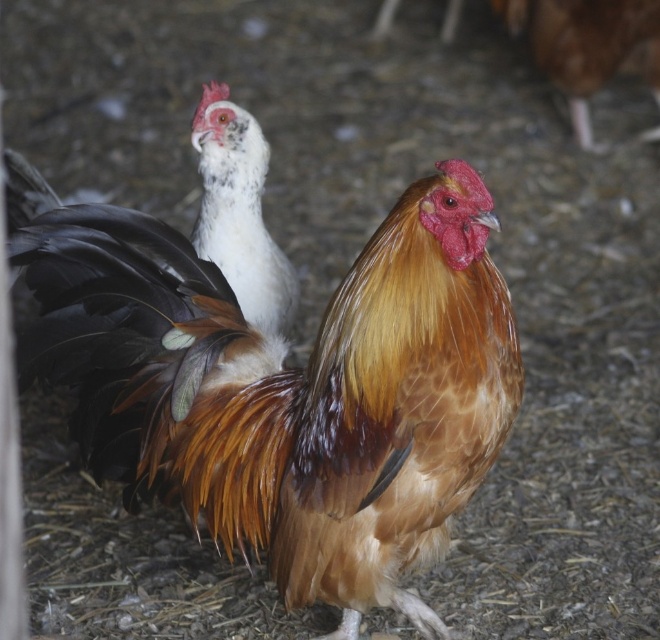
Is brown feathered rooster at center thinner than white feathered chicken at upper left?

No.

Is brown feathered rooster at center taller than white feathered chicken at upper left?

Correct, brown feathered rooster at center is much taller as white feathered chicken at upper left.

Is point (209, 392) behind point (257, 131)?

No, it is not.

This screenshot has width=660, height=640. What are the coordinates of `brown feathered rooster at center` in the screenshot? It's located at (288, 388).